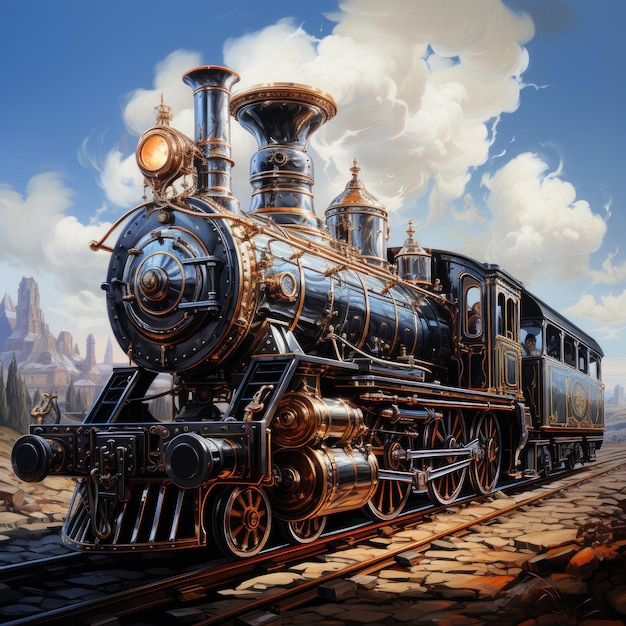
At what (x,y) coordinates should I click in order to perform the action: click on windows. Please return your answer as a coordinate pair (x, y). The height and width of the screenshot is (626, 626). Looking at the image, I should click on (475, 295), (498, 312).